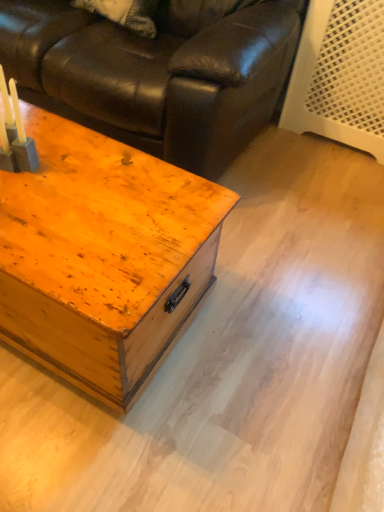
At what (x,y) coordinates should I click in order to perform the action: click on unoccupied space behind matte gray candle holder at left. Please return your answer as a coordinate pair (x, y). Looking at the image, I should click on (52, 136).